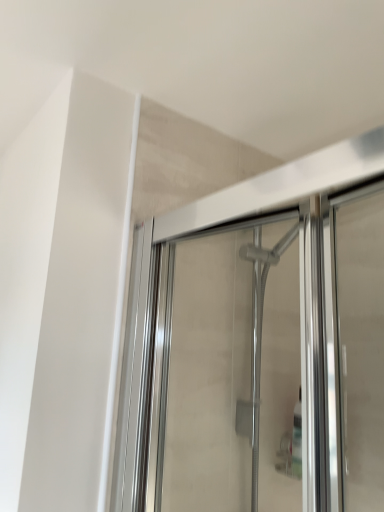
In order to face clear glass shower door at upper center, should I rotate leftwards or rightwards?

It's best to rotate right around 6.608 degrees.

The width and height of the screenshot is (384, 512). What do you see at coordinates (229, 372) in the screenshot?
I see `clear glass shower door at upper center` at bounding box center [229, 372].

Image resolution: width=384 pixels, height=512 pixels. Identify the location of clear glass shower door at upper center. (229, 372).

Find the location of `clear glass shower door at upper center`. clear glass shower door at upper center is located at coordinates (229, 372).